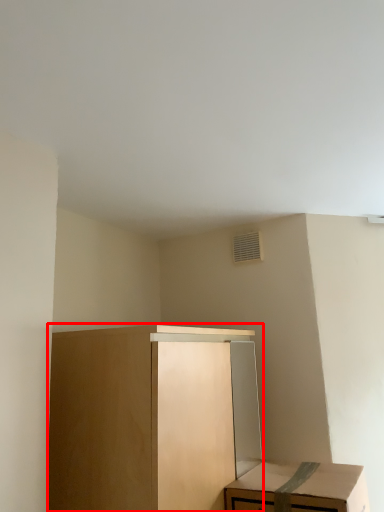
Question: From the image's perspective, where is cabinetry (annotated by the red box) located relative to table?

Choices:
 (A) below
 (B) above

Answer: (B)